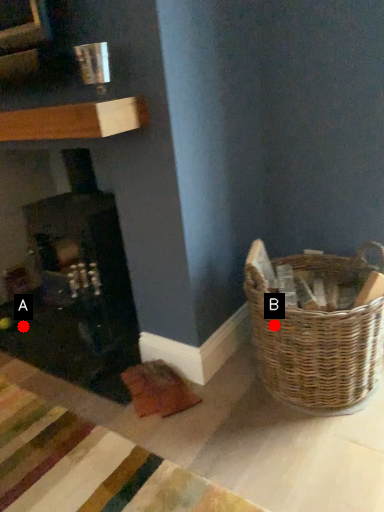
Question: Two points are circled on the image, labeled by A and B beside each circle. Which point is closer to the camera?

Choices:
 (A) A is closer
 (B) B is closer

Answer: (B)